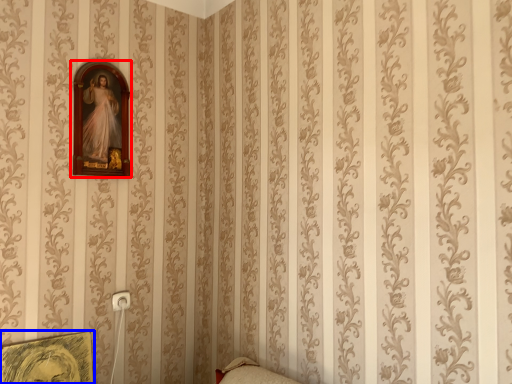
Question: Which of the following is the farthest to the observer, picture frame (highlighted by a red box) or picture frame (highlighted by a blue box)?

Choices:
 (A) picture frame
 (B) picture frame

Answer: (A)